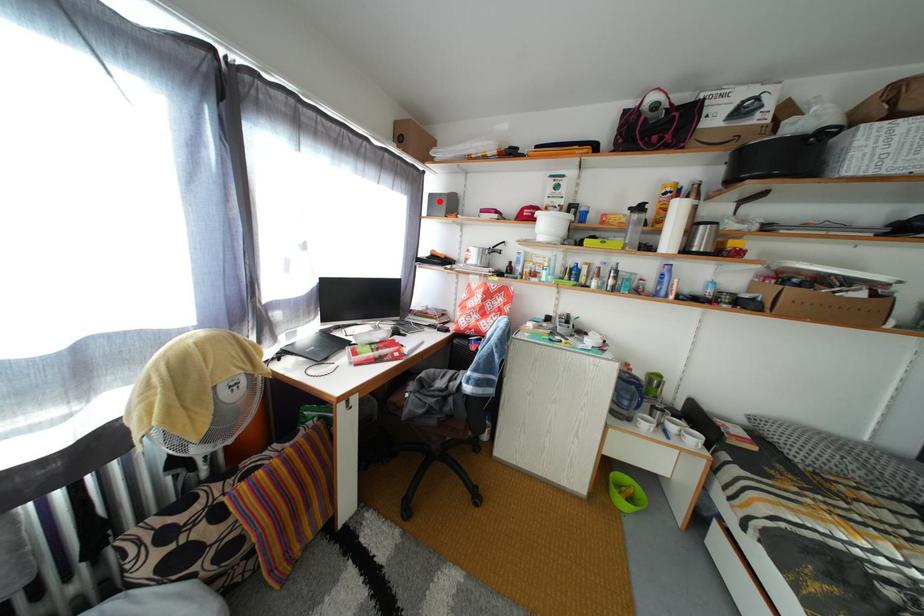
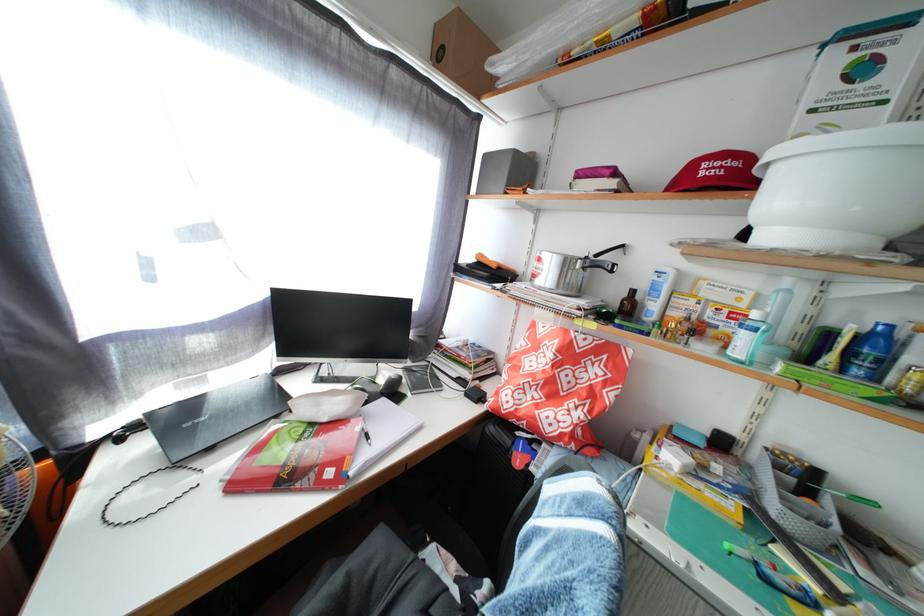
Find the pixel in the second image that matches the highlighted location in the first image.

(494, 163)